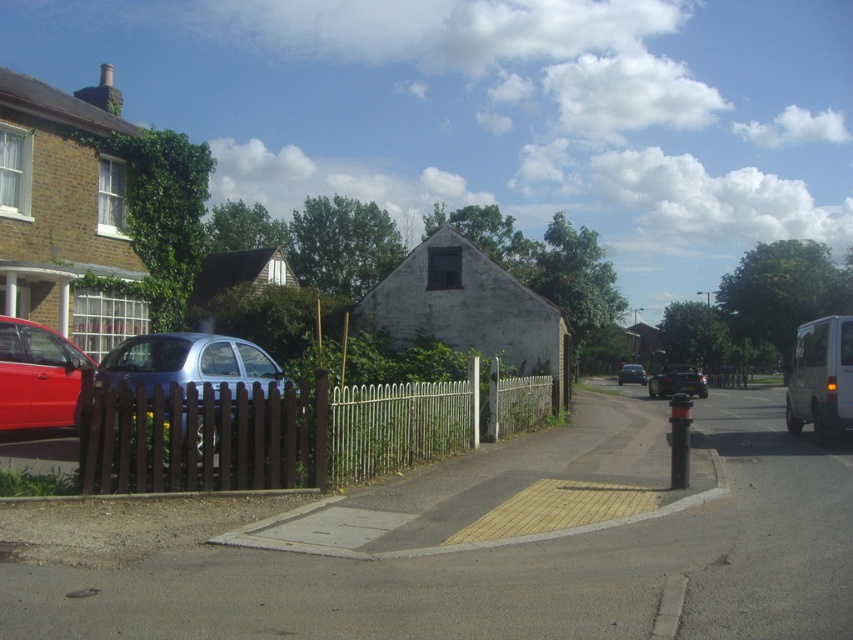
Consider the image. You are a delivery person approaching the brown wooden fence at center and the shiny black car at center. Which object will you encounter first as you walk towards them?

The brown wooden fence at center is closer to the viewer than the shiny black car at center, so you will encounter the brown wooden fence at center first.

You are a delivery person standing at the black bollard at the corner of the road. You need to deliver a package to the house behind the wooden picket fence on the left. To reach the house, you must walk along the tactile paving strip near the curb. Which direction should you walk relative to the shiny red car at left indicated by point (38, 376)?

The shiny red car at left is represented by point (38, 376). Since the house is on the left side of the image and the tactile paving strip is near the curb, you should walk in the direction away from the shiny red car at left indicated by point (38, 376) to reach the house behind the wooden picket fence.